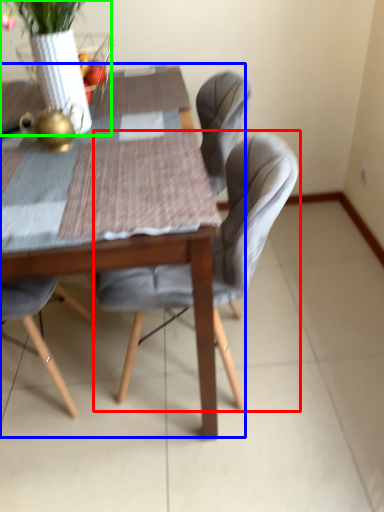
Question: Based on their relative distances, which object is nearer to chair (highlighted by a red box)? Choose from kitchen & dining room table (highlighted by a blue box) and floral arrangement (highlighted by a green box).

Choices:
 (A) kitchen & dining room table
 (B) floral arrangement

Answer: (A)